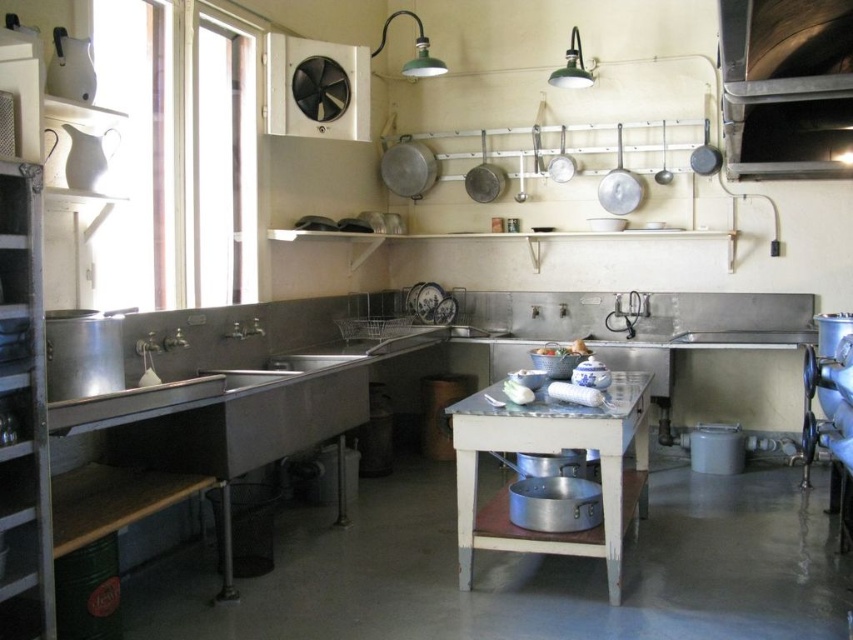
You are a chef preparing to set up a cooking station in the kitchen. You have a large metallic silver table at center and a metallic silver exhaust hood at upper right. Where should you place your cooking equipment to ensure proper ventilation?

You should place your cooking equipment on the metallic silver table at center directly under the metallic silver exhaust hood at upper right to ensure proper ventilation, as the exhaust hood is positioned over the table.